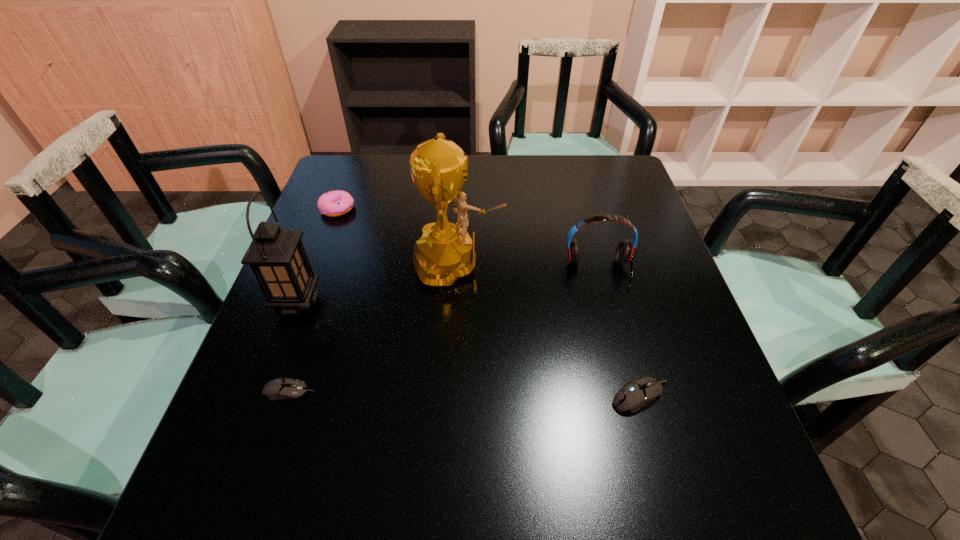
Find the location of a particular element. The height and width of the screenshot is (540, 960). the shortest object is located at coordinates (281, 388).

The width and height of the screenshot is (960, 540). What are the coordinates of `the shorter computer mouse` in the screenshot? It's located at (281, 388).

Locate an element on the screen. Image resolution: width=960 pixels, height=540 pixels. the second shortest object is located at coordinates (635, 393).

Locate an element on the screen. The image size is (960, 540). the right computer mouse is located at coordinates coord(635,393).

Locate an element on the screen. This screenshot has height=540, width=960. the farthest object is located at coordinates (335, 203).

Where is `doughnut`? The width and height of the screenshot is (960, 540). doughnut is located at coordinates (335, 203).

Identify the location of the fourth shortest object. (624, 252).

Image resolution: width=960 pixels, height=540 pixels. Identify the location of the fourth object from left to right. (438, 167).

Where is `lantern`? This screenshot has height=540, width=960. lantern is located at coordinates (276, 256).

This screenshot has width=960, height=540. I want to click on free spot located 0.310m on the right of the shortest object, so click(x=477, y=390).